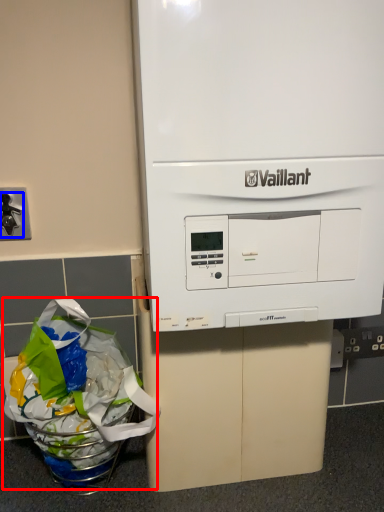
Question: Which of the following is the closest to the observer, grocery bag (highlighted by a red box) or faucet (highlighted by a blue box)?

Choices:
 (A) grocery bag
 (B) faucet

Answer: (A)